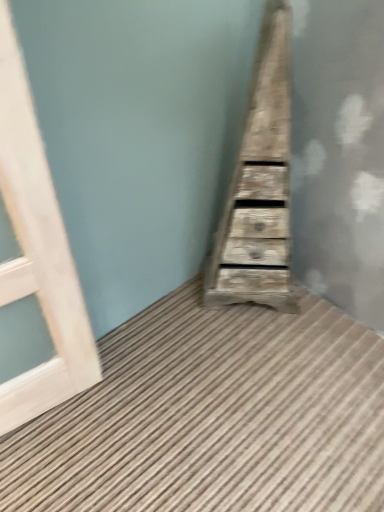
Find the location of a particular element. The image size is (384, 512). free spot to the right of distressed wood dresser at center is located at coordinates (327, 321).